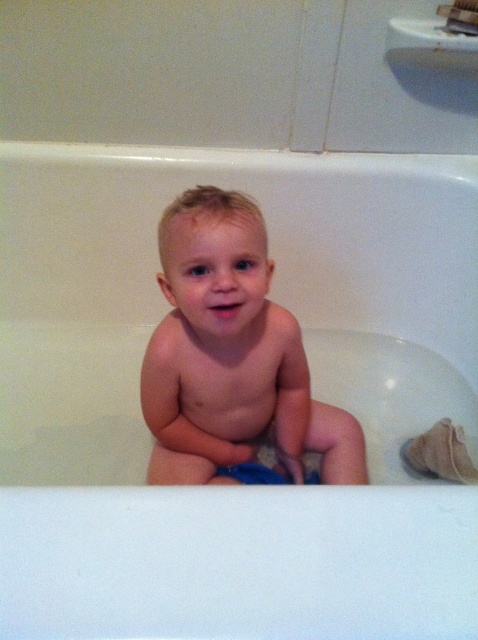
Is point (181, 317) positioned after point (315, 480)?

No, (181, 317) is in front of (315, 480).

Can you confirm if smooth skin baby at center is smaller than blue fabric diaper at center?

Incorrect, smooth skin baby at center is not smaller in size than blue fabric diaper at center.

Which is in front, point (243, 289) or point (252, 483)?

Point (243, 289)

At what (x,y) coordinates should I click in order to perform the action: click on smooth skin baby at center. Please return your answer as a coordinate pair (x, y). Looking at the image, I should click on (230, 355).